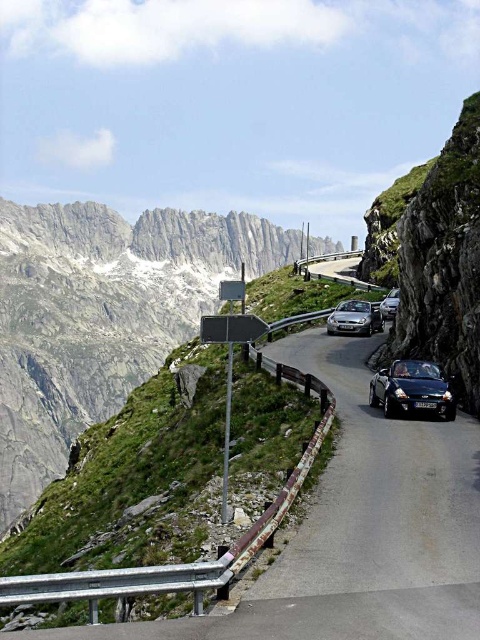
You are a hiker standing on the rugged stone mountain at upper left and want to reach the black matte convertible at center. Which direction should you move to get closer to the car?

Since the rugged stone mountain at upper left is closer to you than the black matte convertible at center, you should move downward or away from the mountain to reach the car.

You are a hiker planning to take a photo of the rugged stone mountain at upper left. To ensure the mountain is in the frame, where should you position yourself relative to the road?

You should position yourself on the left side of the road to capture the rugged stone mountain at upper left in your photo since it is located at point (101, 316) on the left side of the road.

You are a hiker standing on the rugged stone mountain at upper left and want to reach the metallic silver car at center. Which direction should you move to get closer to the car?

You should move to the right because the rugged stone mountain at upper left is to the left of the metallic silver car at center, so moving right would bring you closer to the car.